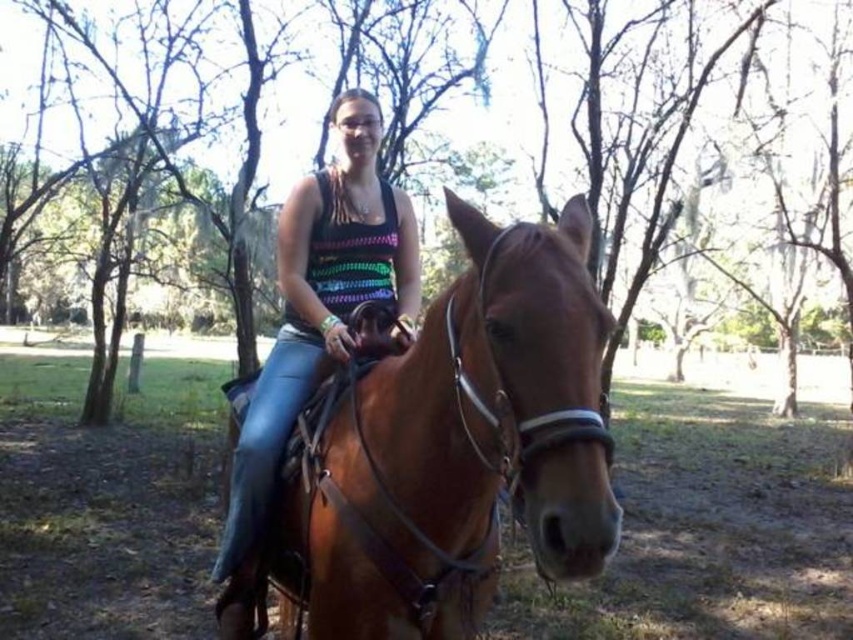
Question: Is the position of brown wood tree at center more distant than that of brown leather horse at center?

Choices:
 (A) yes
 (B) no

Answer: (A)

Question: Is brown wood tree at center thinner than brown leather horse at center?

Choices:
 (A) yes
 (B) no

Answer: (B)

Question: Which object is closer to the camera taking this photo?

Choices:
 (A) brown leather horse at center
 (B) brown wood tree at center

Answer: (A)

Question: Is brown wood tree at center further to the viewer compared to brown leather horse at center?

Choices:
 (A) yes
 (B) no

Answer: (A)